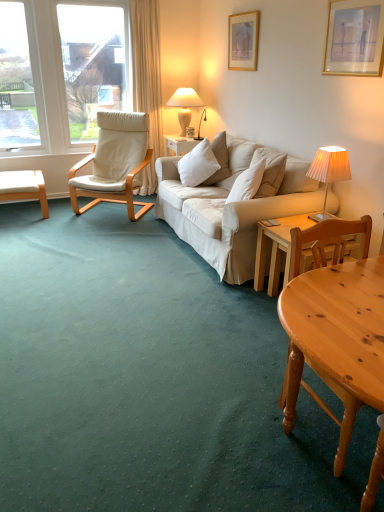
Identify the location of vacant space in front of white leather chair at left, placed as the 2th desk when sorted from bottom to top. This screenshot has height=512, width=384. (26, 225).